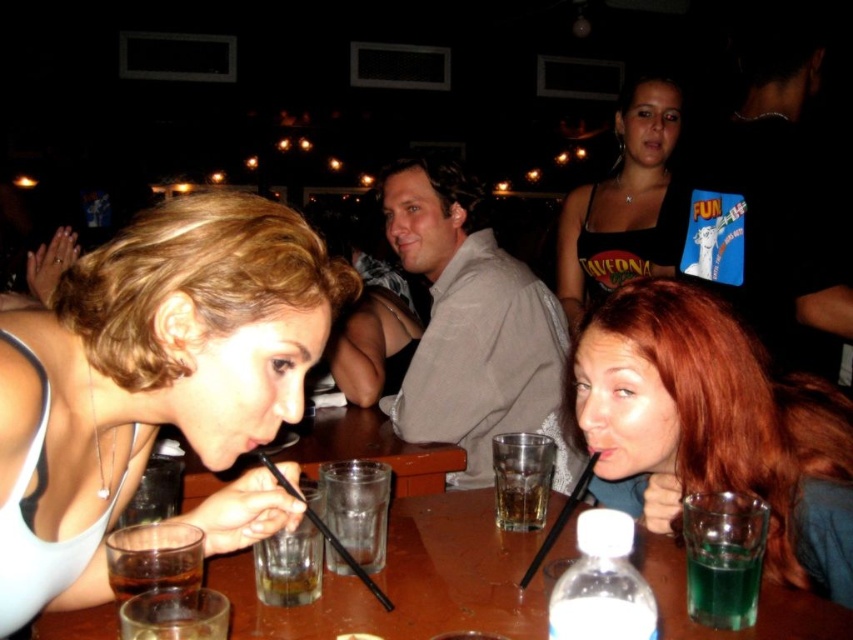
You are a bartender who needs to serve two customers. You have a green translucent glass at lower right and a translucent glass at lower center. Which glass is wider?

The green translucent glass at lower right is wider than the translucent glass at lower center because its width surpasses the other.

You are standing at the point marked as point (798, 192) in the image. You want to walk straight to the exit located at the opposite side of the room. The exit is 10 feet away from you. However, there is a table 3 feet in front of you. Can you walk straight to the exit without hitting the table?

The distance between you and the exit is 10 feet, and the table is only 3 feet in front of you. Since the table is closer than the exit, you would hit the table if you walk straight. Therefore, you need to detour around the table to reach the exit safely.